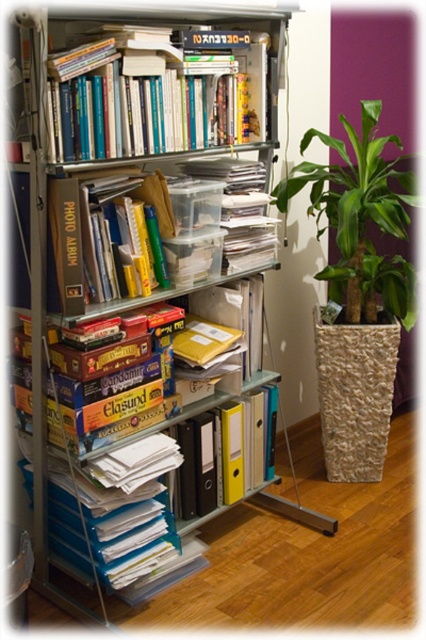
Does hardcover books at upper center have a greater width compared to green leafy plant at right?

No, hardcover books at upper center is not wider than green leafy plant at right.

Is hardcover books at upper center taller than green leafy plant at right?

No, hardcover books at upper center is not taller than green leafy plant at right.

Who is more forward, (89, 120) or (357, 244)?

Point (89, 120)

Identify the location of hardcover books at upper center. This screenshot has width=426, height=640. (155, 93).